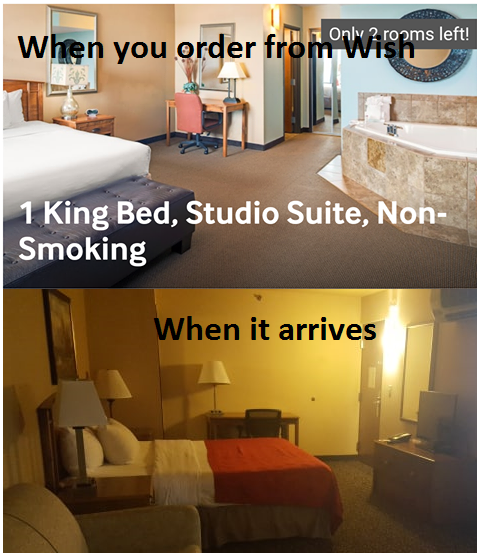
At what (x,y) coordinates should I click in order to perform the action: click on door. Please return your answer as a coordinate pair (x, y). Image resolution: width=477 pixels, height=553 pixels. Looking at the image, I should click on (372, 401).